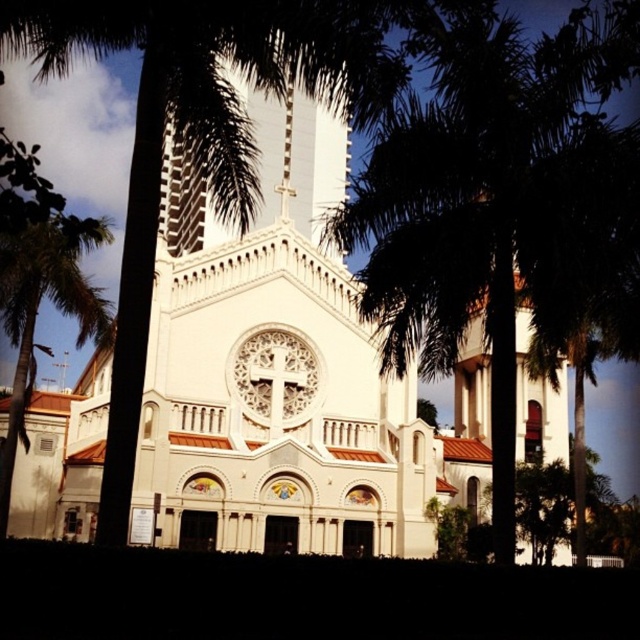
You are standing in front of the white stone church at center and want to take a photo of the green leafy palm tree at left. Will the palm tree be visible in the photo if you frame the shot to include the entire church facade?

The white stone church at center is positioned over the green leafy palm tree at left, so if you frame the shot to include the entire church facade, the palm tree will be partially or fully obscured by the church and may not be visible in the photo.

You are standing in front of the grand church and want to locate the point at coordinates (289, 372). Based on the scene description, where on the church would this point be located?

The point at coordinates (289, 372) is located on the white stone church at center, specifically on its facade.

You are a photographer planning to capture the church facade with both the green leafy palm tree at center and the green leafy palm tree at left in the shot. Which palm tree will appear wider in the photo?

Answer: The green leafy palm tree at center will appear wider in the photo because its width is larger than that of the green leafy palm tree at left.